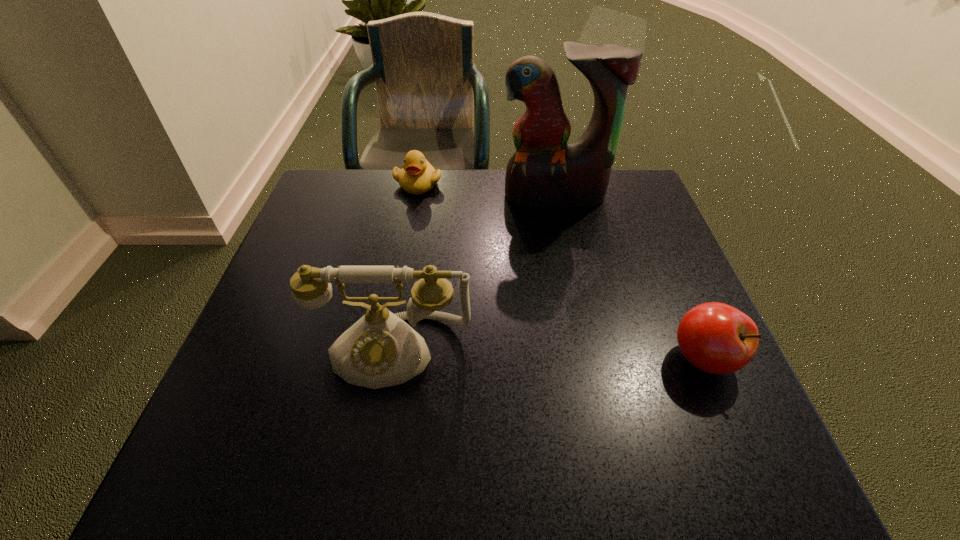
The width and height of the screenshot is (960, 540). What are the coordinates of `free space on the desktop that is between the third shortest object and the rightmost object and is positioned at the face of the tallest object` in the screenshot? It's located at (572, 355).

This screenshot has width=960, height=540. I want to click on free spot on the desktop that is between the second tallest object and the apple and is positioned on the front-facing side of the duckling, so [x=518, y=353].